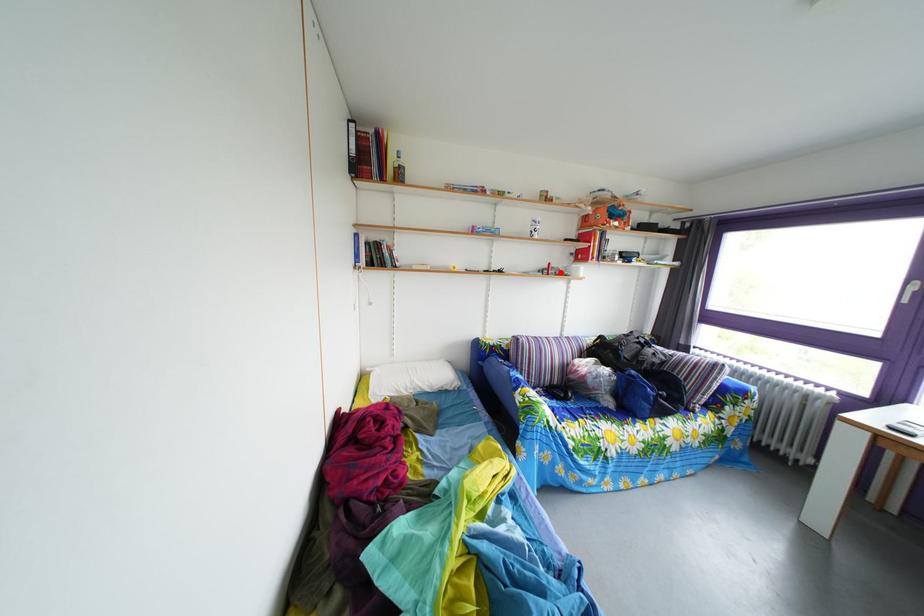
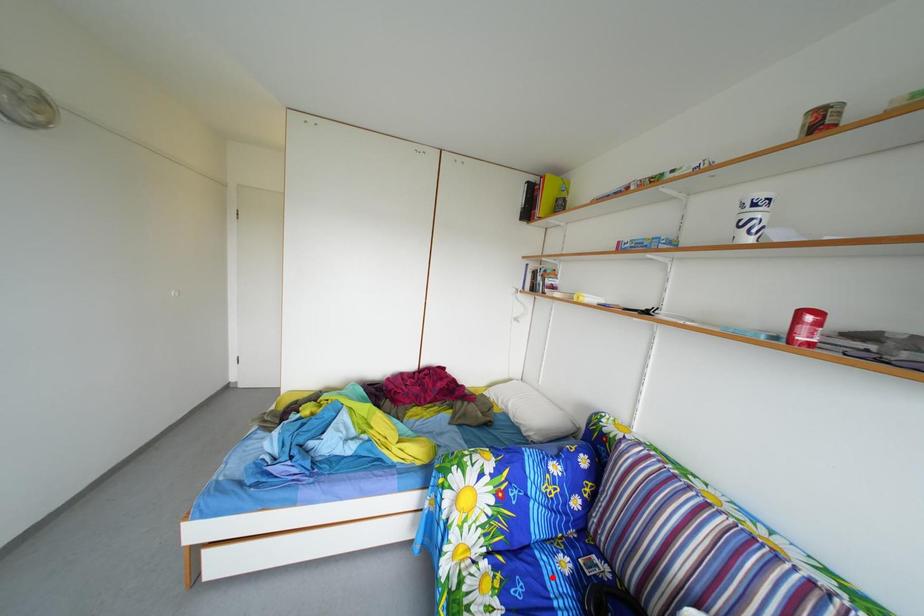
I am providing you with two images of the same scene from different viewpoints. A red point is marked on the first image and another point is marked on the second image. Are the points marked in image1 and image2 representing the same 3D position?

No